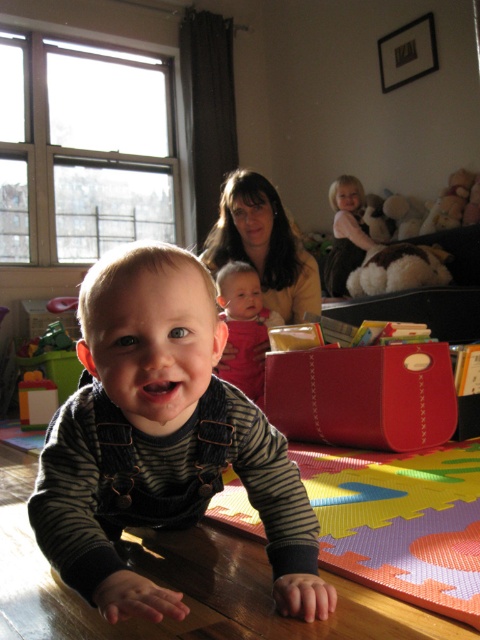
Looking at the scene, where is the multicolored foam puzzle mat at lower center in relation to the matte yellow sweater at upper center?

The multicolored foam puzzle mat at lower center is to the right of the matte yellow sweater at upper center.

In the scene shown: You are a parent trying to ensure your child stays safe while playing on the wooden table. The multicolored foam puzzle mat at lower center is placed at coordinates point (400, 522). Is the mat positioned in a way that it can prevent the child from slipping off the table?

The multicolored foam puzzle mat at lower center is positioned at point (400, 522), which is at the lower center of the table. This placement can help prevent the child from slipping off the table by providing traction and cushioning under their feet.